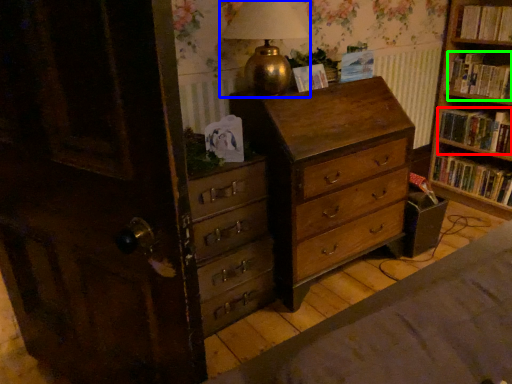
Question: Based on their relative distances, which object is farther from book (highlighted by a red box)? Choose from table lamp (highlighted by a blue box) and book (highlighted by a green box).

Choices:
 (A) table lamp
 (B) book

Answer: (A)